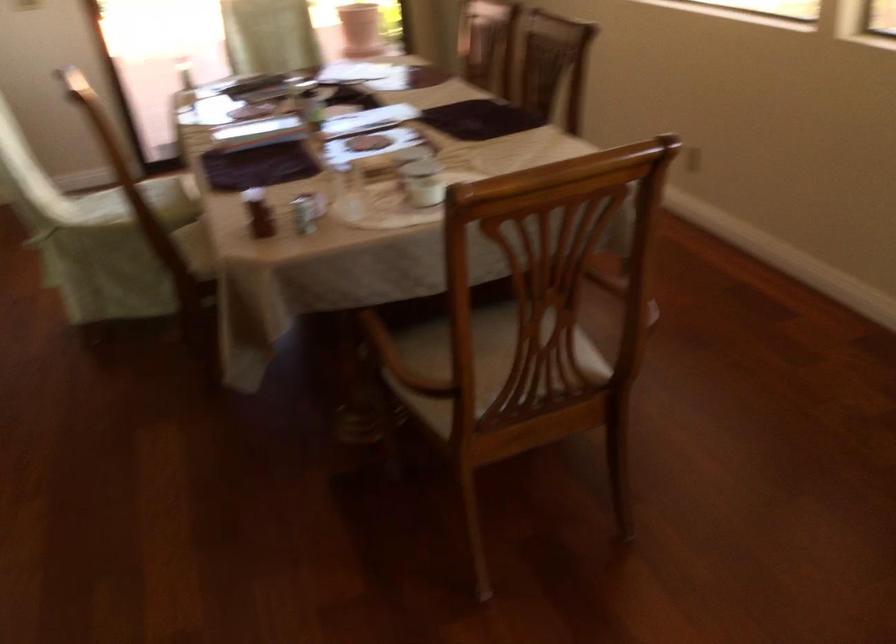
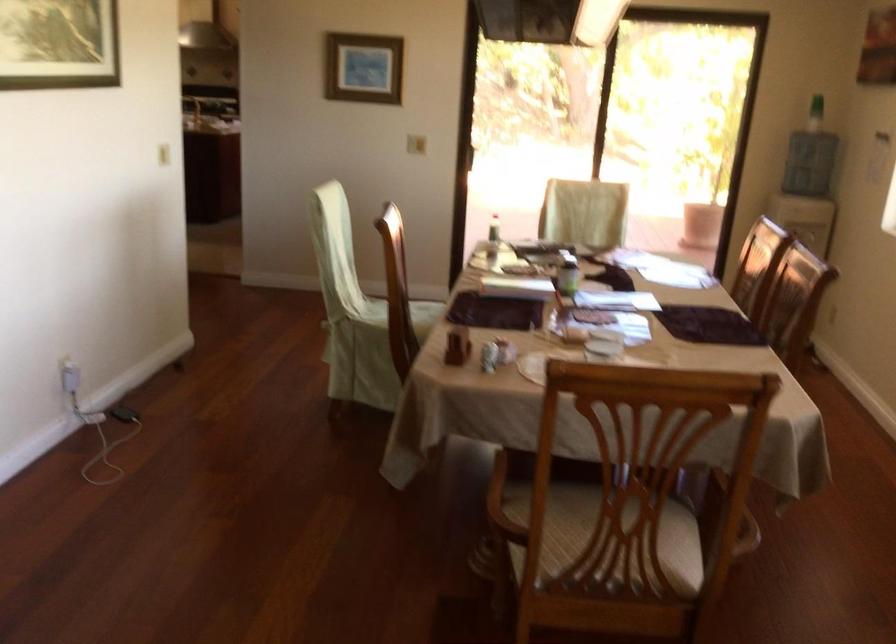
In the second image, find the point that corresponds to [373,366] in the first image.

(503, 504)